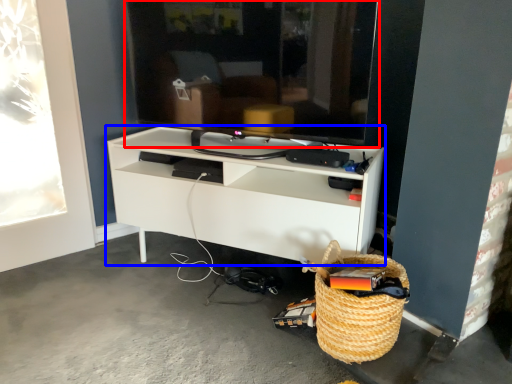
Question: Which point is further to the camera, television (highlighted by a red box) or shelf (highlighted by a blue box)?

Choices:
 (A) television
 (B) shelf

Answer: (B)